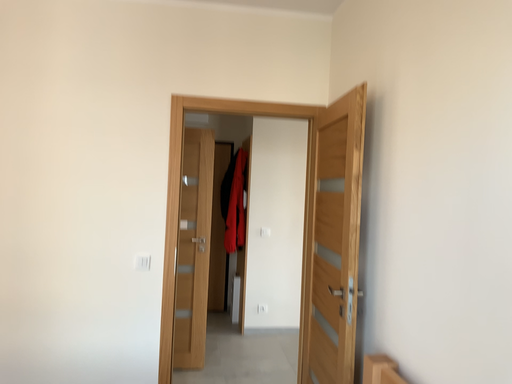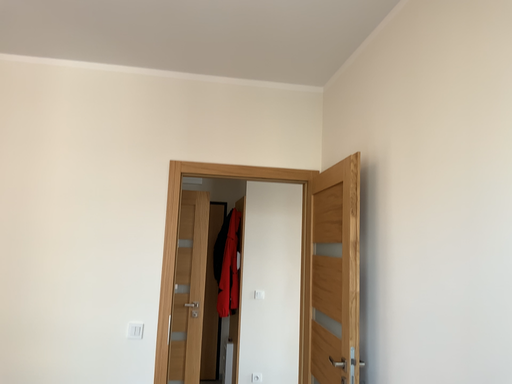
Question: Which way did the camera rotate in the video?

Choices:
 (A) rotated upward
 (B) rotated downward

Answer: (A)